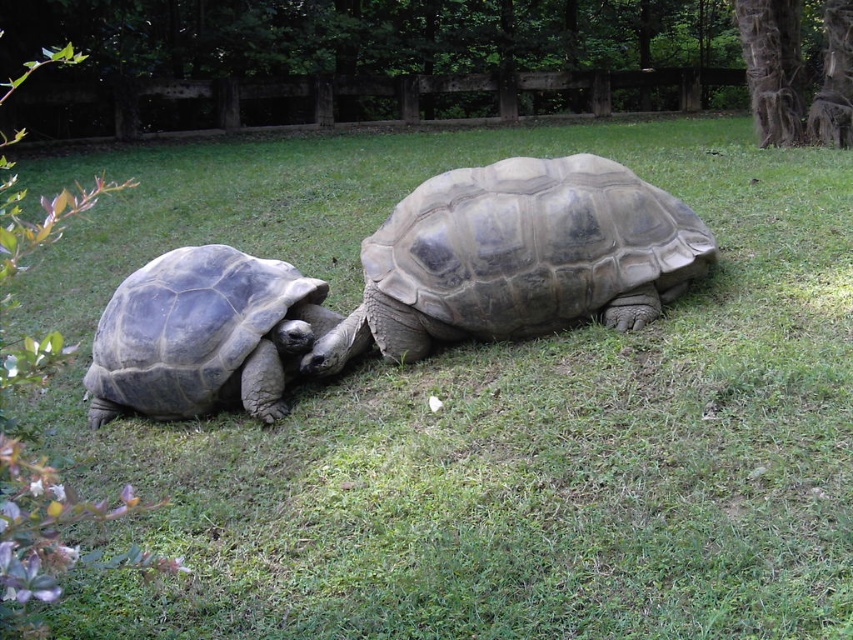
Question: Which object is farther from the camera taking this photo?

Choices:
 (A) gray matte tortoise at left
 (B) gray textured tortoise at center

Answer: (B)

Question: Can you confirm if gray textured tortoise at center is bigger than gray matte tortoise at left?

Choices:
 (A) no
 (B) yes

Answer: (B)

Question: Can you confirm if gray textured tortoise at center is positioned below gray matte tortoise at left?

Choices:
 (A) no
 (B) yes

Answer: (A)

Question: Considering the relative positions of gray textured tortoise at center and gray matte tortoise at left in the image provided, where is gray textured tortoise at center located with respect to gray matte tortoise at left?

Choices:
 (A) left
 (B) right

Answer: (B)

Question: Which point is closer to the camera?

Choices:
 (A) gray textured tortoise at center
 (B) gray matte tortoise at left

Answer: (B)

Question: Which object appears farthest from the camera in this image?

Choices:
 (A) gray textured tortoise at center
 (B) gray matte tortoise at left

Answer: (A)